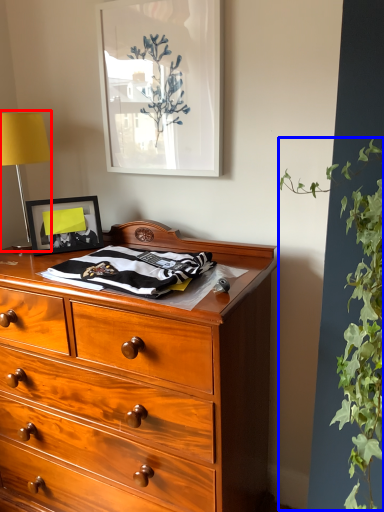
Question: Which point is further to the camera, table lamp (highlighted by a red box) or vegetation (highlighted by a blue box)?

Choices:
 (A) table lamp
 (B) vegetation

Answer: (A)